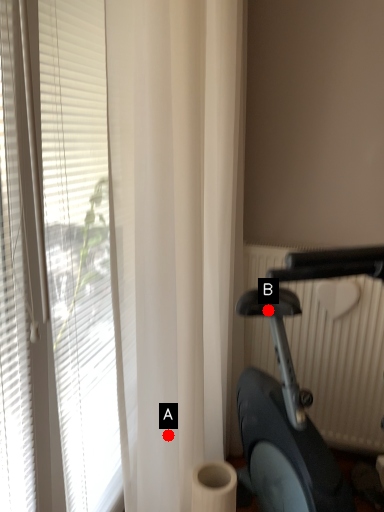
Question: Two points are circled on the image, labeled by A and B beside each circle. Which of the following is the closest to the observer?

Choices:
 (A) A is closer
 (B) B is closer

Answer: (A)